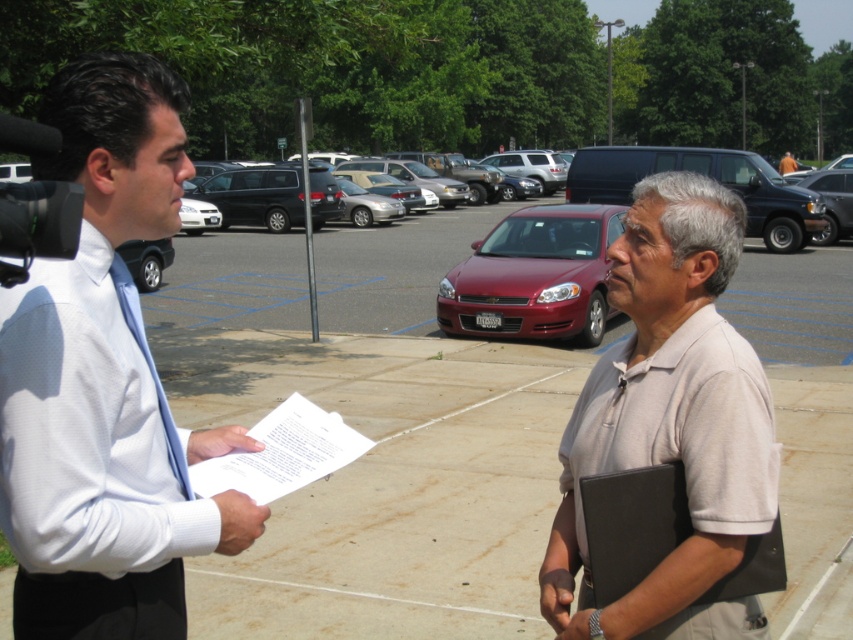
Question: Is white shirt at left to the left of shiny red sedan at center from the viewer's perspective?

Choices:
 (A) yes
 (B) no

Answer: (A)

Question: Does light beige cotton shirt at center come behind shiny red sedan at center?

Choices:
 (A) no
 (B) yes

Answer: (A)

Question: Which point is closer to the camera taking this photo?

Choices:
 (A) (85, 620)
 (B) (169, 413)
 (C) (338, 448)
 (D) (793, 161)

Answer: (A)

Question: Which point is farther from the camera taking this photo?

Choices:
 (A) 679,216
 (B) 65,364
 (C) 786,172

Answer: (C)

Question: Which point is farther to the camera?

Choices:
 (A) shiny red sedan at center
 (B) light beige cotton shirt at center
 (C) blue textured tie at left
 (D) matte black minivan at center

Answer: (D)

Question: Does shiny red sedan at center lie behind white paper at center?

Choices:
 (A) yes
 (B) no

Answer: (A)